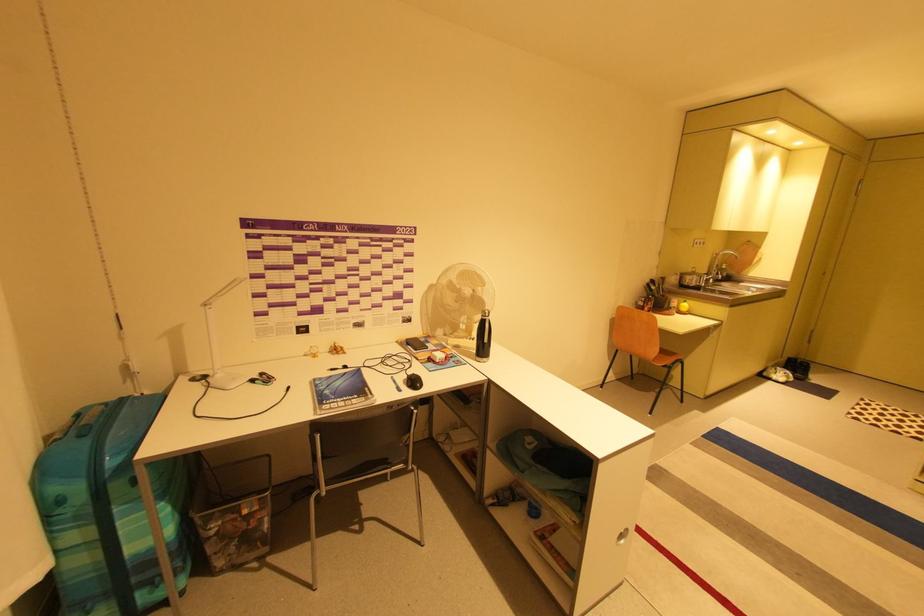
This screenshot has height=616, width=924. What are the coordinates of `yellow lemon container` in the screenshot? It's located at [683, 307].